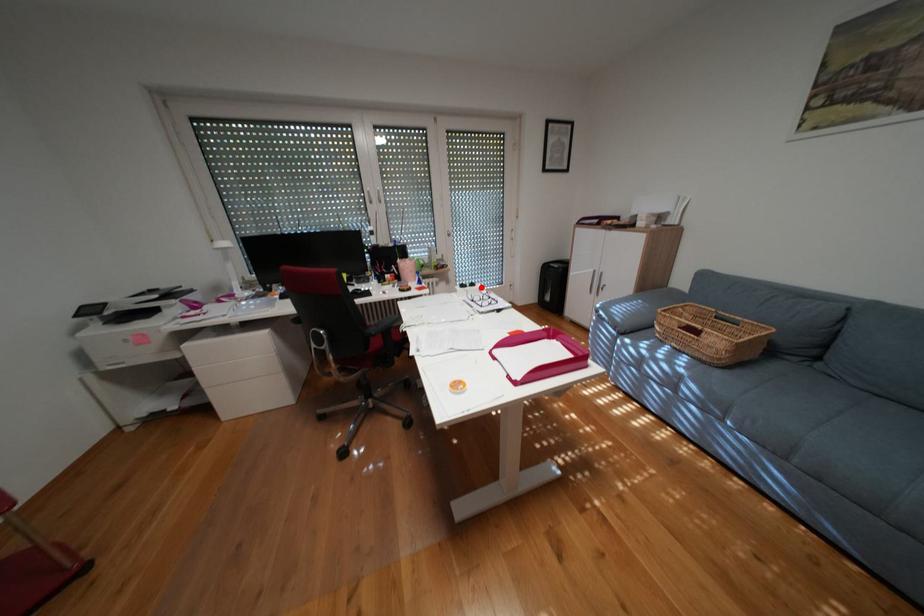
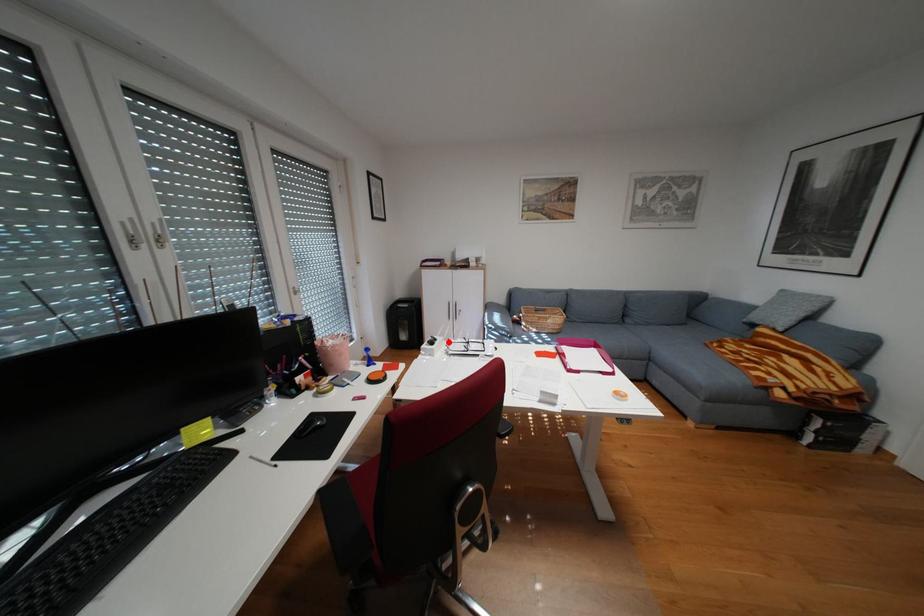
I am providing you with two images of the same scene from different viewpoints. A red point is marked on the first image and another point is marked on the second image. Does the point marked in image1 correspond to the same location as the one in image2?

Yes